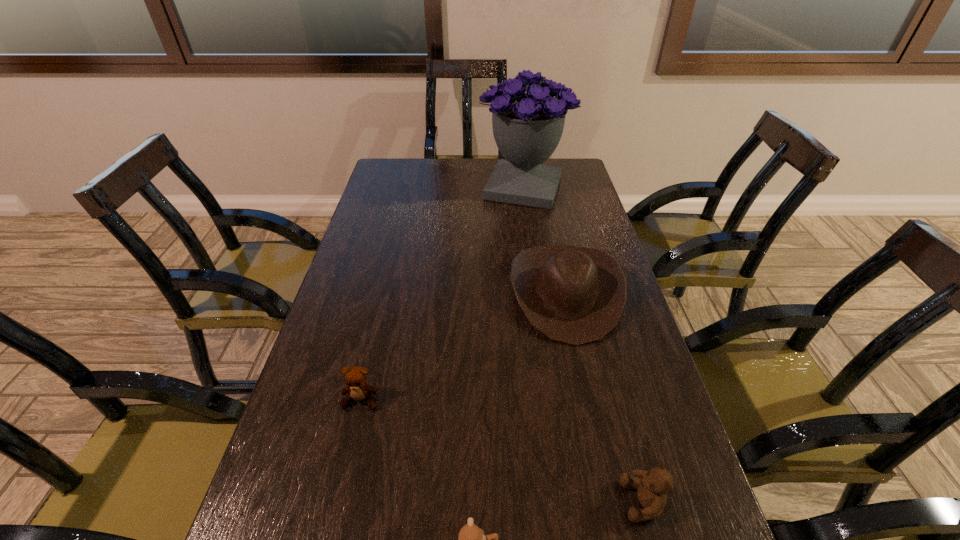
I want to click on the tallest object, so click(x=527, y=127).

Identify the location of bouquet. Image resolution: width=960 pixels, height=540 pixels. (527, 127).

Where is `cowboy hat`? This screenshot has width=960, height=540. cowboy hat is located at coordinates (575, 295).

Find the location of a particular element. the fourth nearest object is located at coordinates (575, 295).

In order to click on the second nearest object in this screenshot , I will do `click(652, 486)`.

What are the coordinates of `the second farthest teddy bear` in the screenshot? It's located at (652, 486).

You are a GUI agent. You are given a task and a screenshot of the screen. Output one action in this format:
    pyautogui.click(x=<x>, y=<y>)
    Task: Click on the farthest teddy bear
    The width and height of the screenshot is (960, 540).
    Given the screenshot: What is the action you would take?
    pyautogui.click(x=356, y=377)

Locate an element on the screen. Image resolution: width=960 pixels, height=540 pixels. the leftmost object is located at coordinates (356, 377).

The image size is (960, 540). In order to click on vacant space located 0.090m on the front of the tallest object in this screenshot , I will do `click(528, 227)`.

You are a GUI agent. You are given a task and a screenshot of the screen. Output one action in this format:
    pyautogui.click(x=<x>, y=<y>)
    Task: Click on the free space located on the left of the fourth nearest object
    
    Given the screenshot: What is the action you would take?
    pyautogui.click(x=481, y=294)